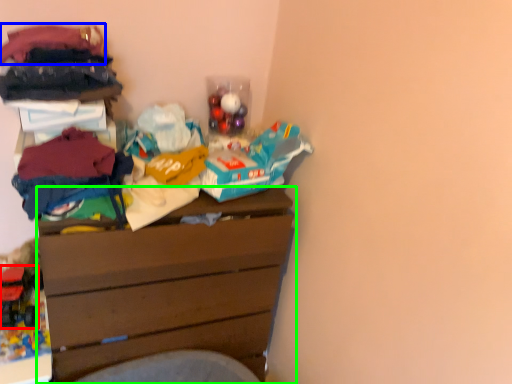
Question: Based on their relative distances, which object is farther from toy (highlighted by a red box)? Choose from clothing (highlighted by a blue box) and chest of drawers (highlighted by a green box).

Choices:
 (A) clothing
 (B) chest of drawers

Answer: (A)